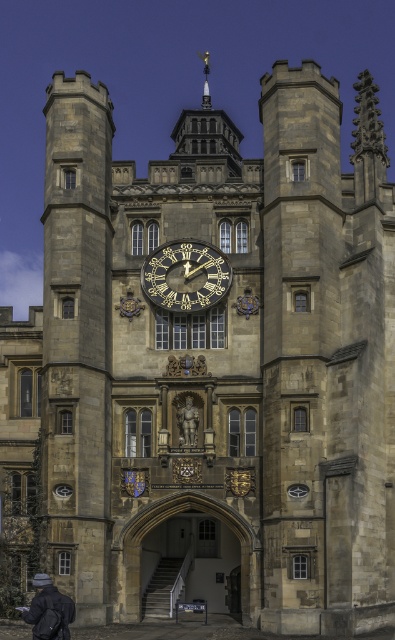
Is gold metallic clock at center in front of dark gray knit hat at lower left?

No, gold metallic clock at center is behind dark gray knit hat at lower left.

Who is more forward, [216,282] or [67,620]?

Point [67,620] is more forward.

I want to click on gold metallic clock at center, so click(186, 275).

Between gold metallic clock at center and polished bronze statue at center, which one appears on the right side from the viewer's perspective?

polished bronze statue at center

How distant is gold metallic clock at center from polished bronze statue at center?

gold metallic clock at center is 6.16 meters from polished bronze statue at center.

You are a GUI agent. You are given a task and a screenshot of the screen. Output one action in this format:
    pyautogui.click(x=<x>, y=<y>)
    Task: Click on the gold metallic clock at center
    The image size is (395, 640).
    Given the screenshot: What is the action you would take?
    pyautogui.click(x=186, y=275)

Does dark gray knit hat at lower left have a greater width compared to polished bronze statue at center?

Yes.

Measure the distance from dark gray knit hat at lower left to polished bronze statue at center.

dark gray knit hat at lower left is 10.09 meters away from polished bronze statue at center.

Locate an element on the screen. dark gray knit hat at lower left is located at coordinates 48,611.